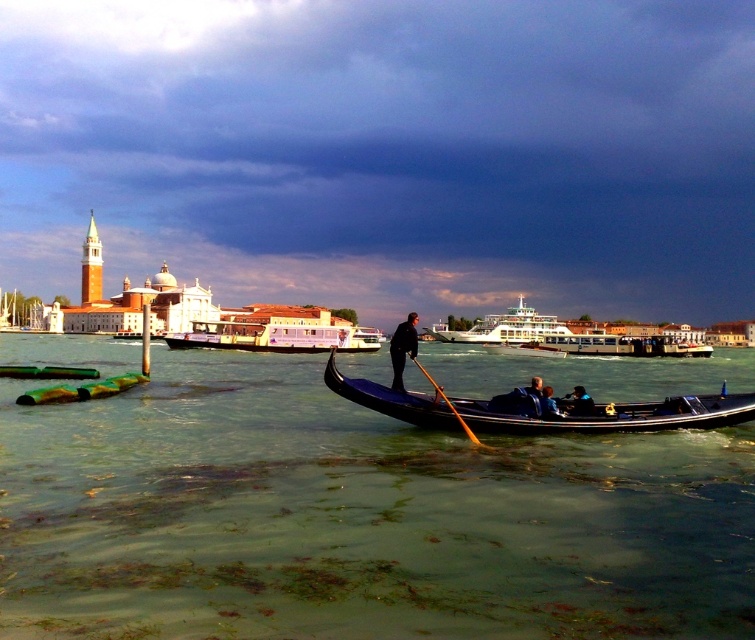
Question: Does white glossy ferry at center appear over dark blue fabric gondolier at center?

Choices:
 (A) no
 (B) yes

Answer: (B)

Question: Is green algae water at center above dark blue fabric gondolier at center?

Choices:
 (A) no
 (B) yes

Answer: (A)

Question: Considering the real-world distances, which object is closest to the cloudy sky at upper center?

Choices:
 (A) green algae water at center
 (B) blue fabric jacket at center
 (C) shiny black gondola at center

Answer: (A)

Question: Does shiny black gondola at center appear on the right side of purple glossy ferry at center?

Choices:
 (A) yes
 (B) no

Answer: (A)

Question: Which of the following is the farthest from the observer?

Choices:
 (A) (245, 572)
 (B) (604, 404)

Answer: (B)

Question: Which point appears closest to the camera in this image?

Choices:
 (A) (28, 138)
 (B) (586, 412)
 (C) (219, 340)
 (D) (525, 317)

Answer: (B)